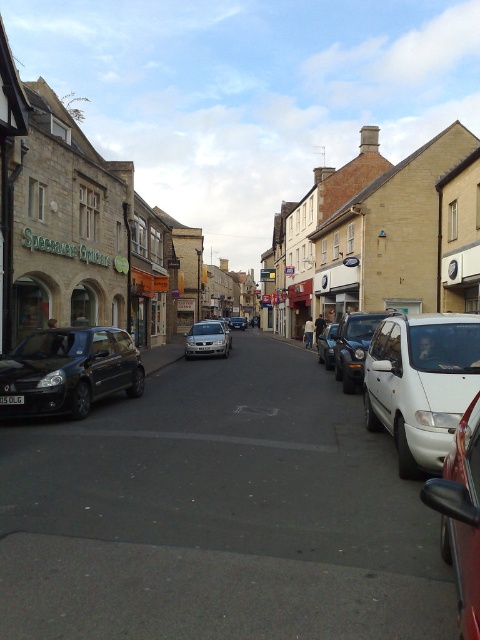
Does white matte van at center appear on the left side of silver metallic car at center?

Incorrect, white matte van at center is not on the left side of silver metallic car at center.

You are a GUI agent. You are given a task and a screenshot of the screen. Output one action in this format:
    pyautogui.click(x=<x>, y=<y>)
    Task: Click on the white matte van at center
    The width and height of the screenshot is (480, 640).
    Given the screenshot: What is the action you would take?
    pyautogui.click(x=354, y=346)

Is white matte van at right below metallic red car at right?

Actually, white matte van at right is above metallic red car at right.

Locate an element on the screen. The width and height of the screenshot is (480, 640). white matte van at right is located at coordinates (420, 384).

Is point (383, 424) positioned behind point (466, 612)?

Yes, point (383, 424) is behind point (466, 612).

Locate an element on the screen. white matte van at right is located at coordinates (420, 384).

Can you confirm if metallic red car at right is positioned to the right of silver metallic sedan at center?

Yes, metallic red car at right is to the right of silver metallic sedan at center.

Between metallic red car at right and silver metallic sedan at center, which one appears on the left side from the viewer's perspective?

silver metallic sedan at center is more to the left.

You are a GUI agent. You are given a task and a screenshot of the screen. Output one action in this format:
    pyautogui.click(x=<x>, y=<y>)
    Task: Click on the metallic red car at right
    The image size is (480, 640).
    Given the screenshot: What is the action you would take?
    pyautogui.click(x=460, y=516)